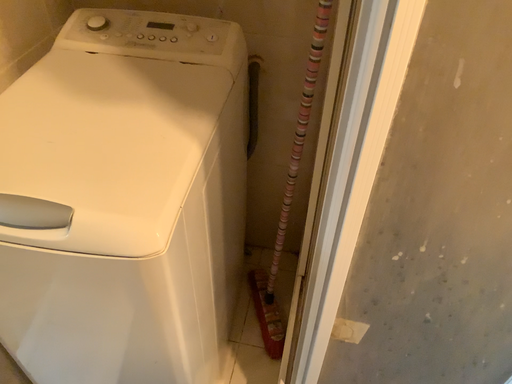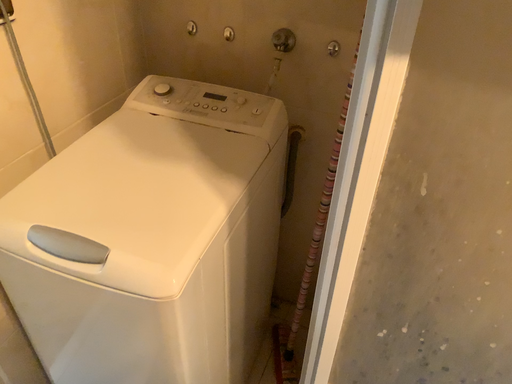
Question: How did the camera likely rotate when shooting the video?

Choices:
 (A) rotated upward
 (B) rotated downward

Answer: (A)